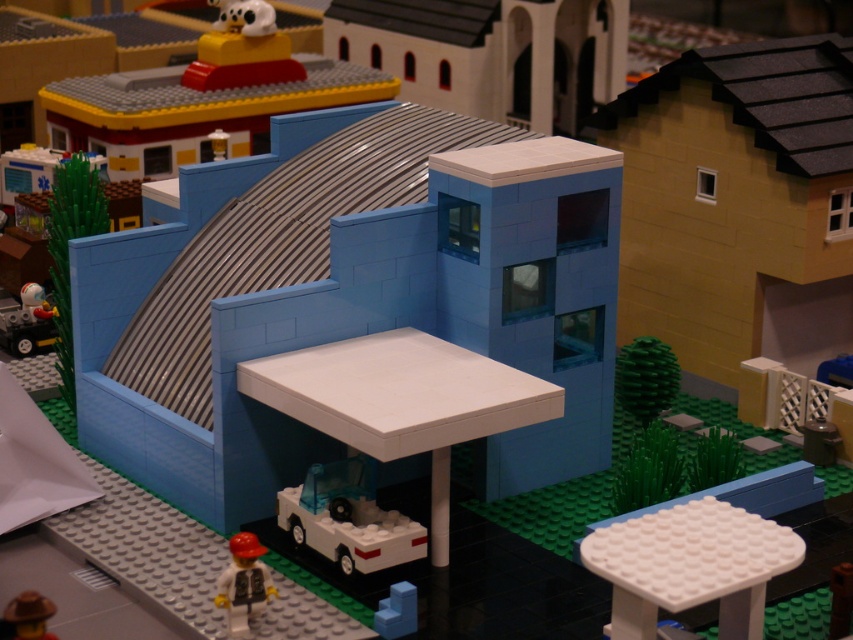
You are trying to decide whether the transparent plastic car at lower center can fit through a narrow doorway that is the same width as the brown matte hat at lower left. Based on their sizes, can the car pass through the doorway?

The transparent plastic car at lower center is wider than the brown matte hat at lower left. Since the doorway is as wide as the hat, the car cannot pass through the doorway.